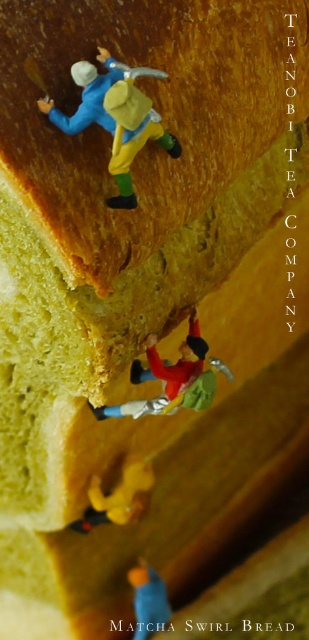
You are a miniature explorer trying to climb the matcha bread. You have a matte plastic toy at upper left and a matte yellow figure at upper center in your path. Which object do you need to avoid stepping on because it is wider?

The matte plastic toy at upper left is wider than the matte yellow figure at upper center, so you should avoid stepping on the matte plastic toy at upper left.

Looking at the miniature scene of the matcha bread climbers, where is the matte plastic toy at upper left in relation to the matte yellow figure at upper center?

The matte plastic toy at upper left is positioned to the left of the matte yellow figure at upper center.

You are a miniature climber trying to reach the top of the matcha bread. You see a matte plastic toy at upper left and a red fabric climbing gear at center. Which object should you grab first to progress upward?

The matte plastic toy at upper left is to the left of the red fabric climbing gear at center, so you should grab the matte plastic toy at upper left first to progress upward.